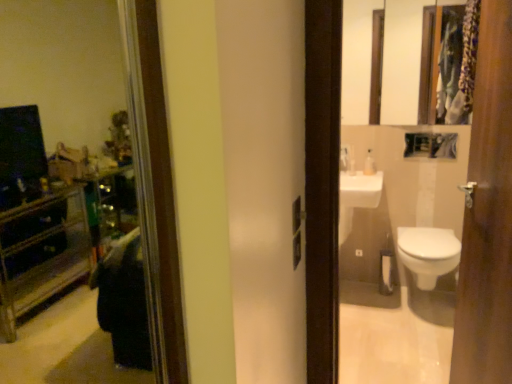
Question: Is the depth of wooden door at right greater than that of white glossy toilet at lower right?

Choices:
 (A) no
 (B) yes

Answer: (A)

Question: Can white glossy toilet at lower right be found inside wooden door at right?

Choices:
 (A) yes
 (B) no

Answer: (B)

Question: Does wooden door at right come in front of white glossy toilet at lower right?

Choices:
 (A) yes
 (B) no

Answer: (A)

Question: Considering the relative sizes of wooden door at right and white glossy toilet at lower right in the image provided, is wooden door at right taller than white glossy toilet at lower right?

Choices:
 (A) yes
 (B) no

Answer: (A)

Question: From the image's perspective, is wooden door at right above white glossy toilet at lower right?

Choices:
 (A) yes
 (B) no

Answer: (A)

Question: From the image's perspective, relative to wooden door at right, is wooden framed mirror at upper right above or below?

Choices:
 (A) below
 (B) above

Answer: (B)

Question: Is wooden framed mirror at upper right in front of or behind wooden door at right in the image?

Choices:
 (A) front
 (B) behind

Answer: (B)

Question: Visually, is wooden framed mirror at upper right positioned to the left or to the right of wooden door at right?

Choices:
 (A) left
 (B) right

Answer: (B)

Question: In terms of height, does wooden framed mirror at upper right look taller or shorter compared to wooden door at right?

Choices:
 (A) short
 (B) tall

Answer: (A)

Question: Considering the positions of white glossy soap dispenser at upper center and wooden door at right in the image, is white glossy soap dispenser at upper center taller or shorter than wooden door at right?

Choices:
 (A) short
 (B) tall

Answer: (A)

Question: Is white glossy soap dispenser at upper center spatially inside wooden door at right, or outside of it?

Choices:
 (A) inside
 (B) outside

Answer: (B)

Question: From a real-world perspective, is white glossy soap dispenser at upper center above or below wooden door at right?

Choices:
 (A) below
 (B) above

Answer: (B)

Question: Considering the positions of white glossy soap dispenser at upper center and wooden door at right in the image, is white glossy soap dispenser at upper center wider or thinner than wooden door at right?

Choices:
 (A) wide
 (B) thin

Answer: (B)

Question: From the image's perspective, is white glossy soap dispenser at upper center located above or below white glossy toilet at lower right?

Choices:
 (A) below
 (B) above

Answer: (B)

Question: In terms of size, does white glossy soap dispenser at upper center appear bigger or smaller than white glossy toilet at lower right?

Choices:
 (A) big
 (B) small

Answer: (B)